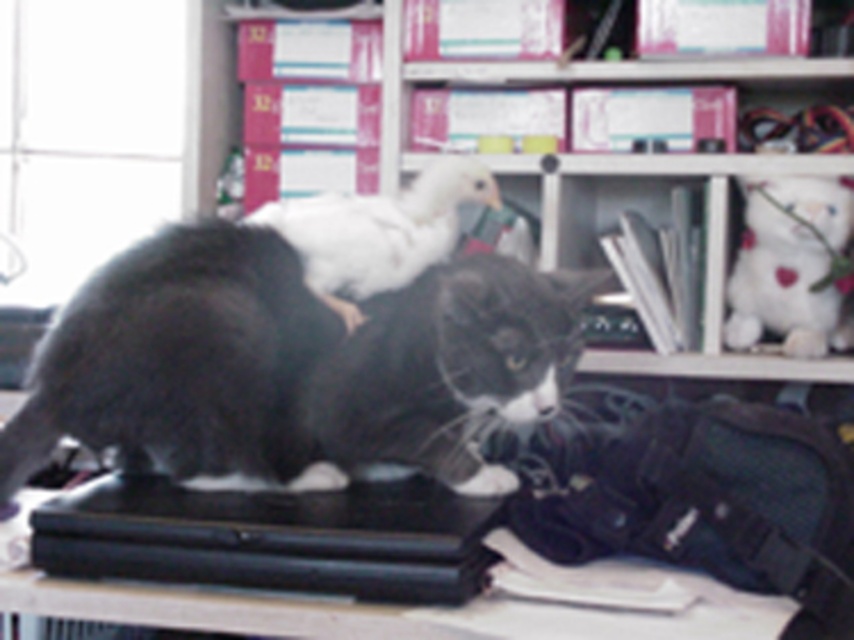
You are a delivery person who just arrived at a house. You need to place a new package on the desk where the black cat is sitting on the closed laptop. The package must be placed at the exact coordinates of point (705, 248). Can you confirm if there is enough space at that point to place the package without disturbing the cat or the laptop?

The pink cardboard boxes at upper center is located at point (705, 248), so placing the package there would require moving the pink cardboard boxes at upper center first.

You are a delivery person who just arrived at the desk. You need to place a new package on the pink cardboard boxes at upper center and the white fluffy duckling at center. Which object should you place the package on first to avoid disturbing the cat and parrot?

You should place the package on the pink cardboard boxes at upper center first because it is closer to you than the white fluffy duckling at center, so you can reach it without disturbing the cat and parrot below.

You are a delivery robot that needs to place a package on the desk without disturbing the black fur cat at center or the black matte laptop at center. The package is 15 centimeters wide. Can you fit it between them?

The black fur cat at center and black matte laptop at center are 14.78 centimeters apart. Since the package is 15 centimeters wide, it cannot fit between them as there is insufficient space.